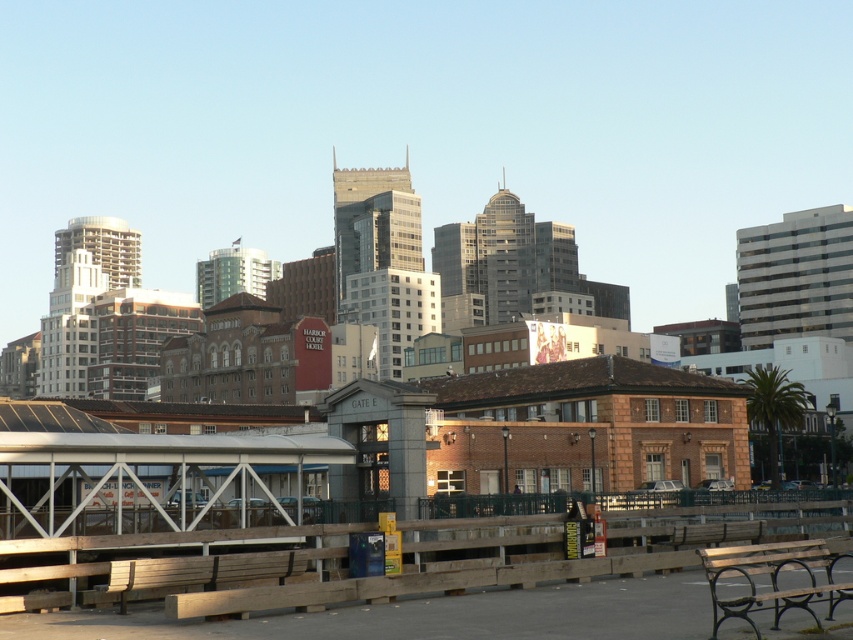
You are a maintenance worker needing to move from the wooden bench at lower left to the wooden bench at lower right to check for damage. Given that your tool cart is 1.5 meters wide, can you safely navigate the path between them without moving the benches?

The distance between the wooden bench at lower right and wooden bench at lower left is 9.28 meters. Since the tool cart is only 1.5 meters wide, the path between them is wide enough to allow safe passage without needing to move the benches.